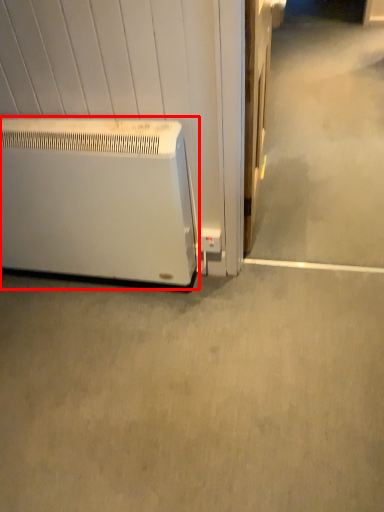
Question: From the image's perspective, considering the relative positions of home appliance (annotated by the red box) and concrete in the image provided, where is home appliance (annotated by the red box) located with respect to the staircase?

Choices:
 (A) above
 (B) below

Answer: (A)